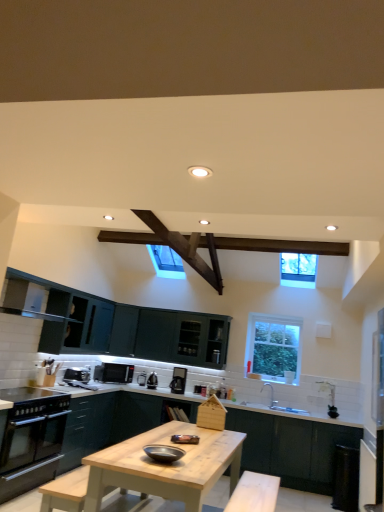
Question: Does satin black kettle at center, the third appliance when ordered from left to right, have a greater height compared to clear glass window at upper right, marked as the second window in a top-to-bottom arrangement?

Choices:
 (A) no
 (B) yes

Answer: (A)

Question: Can you confirm if satin black kettle at center, marked as the first appliance in a back-to-front arrangement, is positioned to the right of clear glass window at upper right, the first window when ordered from bottom to top?

Choices:
 (A) no
 (B) yes

Answer: (A)

Question: Can you confirm if satin black kettle at center, marked as the first appliance in a back-to-front arrangement, is positioned to the left of clear glass window at upper right, marked as the second window in a top-to-bottom arrangement?

Choices:
 (A) no
 (B) yes

Answer: (B)

Question: Is satin black kettle at center, which is the third appliance in right-to-left order, turned away from clear glass window at upper right, which is the 1th window in back-to-front order?

Choices:
 (A) yes
 (B) no

Answer: (B)

Question: Can you confirm if satin black kettle at center, the fifth appliance viewed from the front, is wider than clear glass window at upper right, which is the 1th window in back-to-front order?

Choices:
 (A) yes
 (B) no

Answer: (A)

Question: From the image's perspective, would you say satin black kettle at center, the fifth appliance viewed from the front, is positioned over clear glass window at upper right, the 2th window viewed from the front?

Choices:
 (A) yes
 (B) no

Answer: (B)

Question: Considering the relative positions of matte black microwave at center, the second appliance from the back, and satin black kettle at center, the fifth appliance viewed from the front, in the image provided, is matte black microwave at center, the second appliance from the back, in front of satin black kettle at center, the fifth appliance viewed from the front,?

Choices:
 (A) no
 (B) yes

Answer: (B)

Question: Is the position of matte black microwave at center, positioned as the 4th appliance in front-to-back order, more distant than that of satin black kettle at center, the fifth appliance viewed from the front?

Choices:
 (A) yes
 (B) no

Answer: (B)

Question: Does matte black microwave at center, positioned as the 4th appliance in front-to-back order, have a greater width compared to satin black kettle at center, marked as the first appliance in a back-to-front arrangement?

Choices:
 (A) no
 (B) yes

Answer: (B)

Question: Does matte black microwave at center, which is the 4th appliance in right-to-left order, have a smaller size compared to satin black kettle at center, the third appliance when ordered from left to right?

Choices:
 (A) yes
 (B) no

Answer: (B)

Question: Is matte black microwave at center, the second appliance from the back, positioned with its back to satin black kettle at center, which is the third appliance in right-to-left order?

Choices:
 (A) yes
 (B) no

Answer: (B)

Question: Considering the relative positions of matte black microwave at center, the second appliance from the back, and satin black kettle at center, the third appliance when ordered from left to right, in the image provided, is matte black microwave at center, the second appliance from the back, to the right of satin black kettle at center, the third appliance when ordered from left to right, from the viewer's perspective?

Choices:
 (A) no
 (B) yes

Answer: (A)

Question: From the image's perspective, is matte dark green cabinet at center, arranged as the second cabinetry when viewed from the right, beneath black plastic toaster at lower left, marked as the second appliance in a front-to-back arrangement?

Choices:
 (A) yes
 (B) no

Answer: (A)